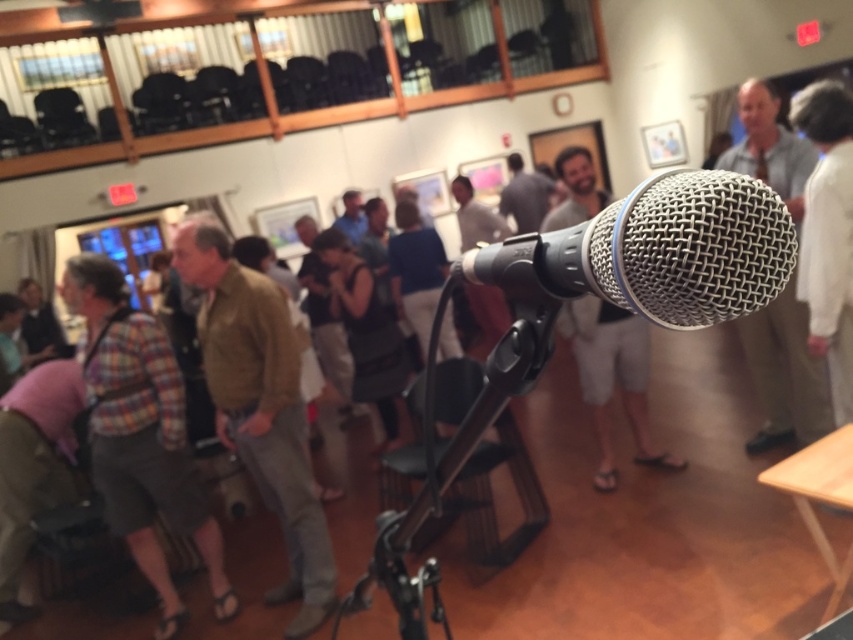
Question: Which of the following is the farthest from the observer?

Choices:
 (A) (84, 355)
 (B) (816, 436)
 (C) (817, 232)

Answer: (B)

Question: Can you confirm if plaid fabric shirt at left is positioned above white fabric shirt at right?

Choices:
 (A) no
 (B) yes

Answer: (A)

Question: Can you confirm if plaid fabric shirt at left is positioned below light beige pants at center?

Choices:
 (A) yes
 (B) no

Answer: (A)

Question: Which object is positioned closest to the silver mesh microphone at center?

Choices:
 (A) white fabric shirt at right
 (B) light beige pants at center
 (C) brown leather jacket at center
 (D) plaid fabric shirt at left

Answer: (C)

Question: Which point is closer to the camera taking this photo?

Choices:
 (A) click(x=219, y=417)
 (B) click(x=112, y=401)
 (C) click(x=668, y=234)

Answer: (C)

Question: Is light beige pants at center positioned at the back of white fabric shirt at right?

Choices:
 (A) yes
 (B) no

Answer: (A)